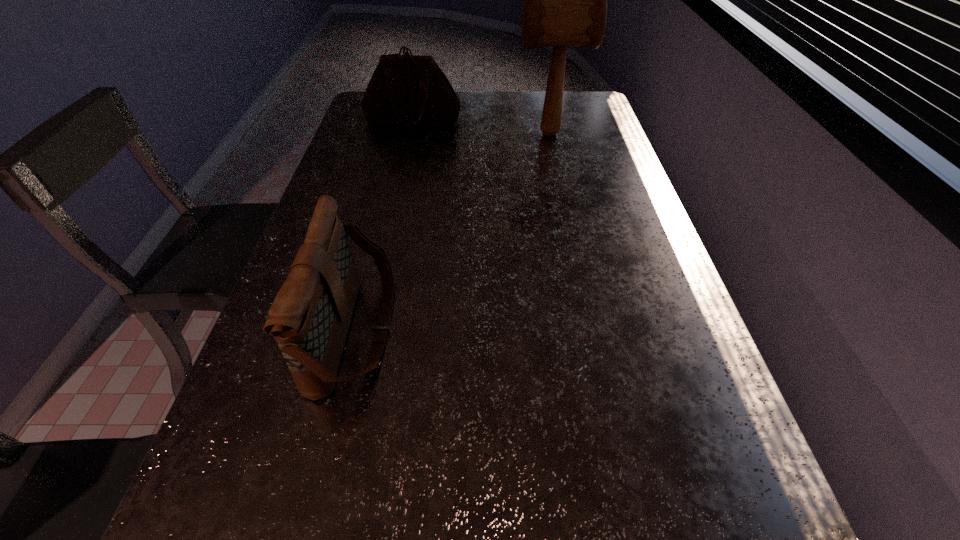
Find the location of `free point between the tallest object and the nearest object`. free point between the tallest object and the nearest object is located at coordinates (452, 232).

Image resolution: width=960 pixels, height=540 pixels. I want to click on object that is the nearest to the tallest object, so click(x=410, y=90).

Identify which object is the closest to the farther shoulder bag. Please provide its 2D coordinates. Your answer should be formatted as a tuple, i.e. [(x, y)], where the tuple contains the x and y coordinates of a point satisfying the conditions above.

[(565, 0)]